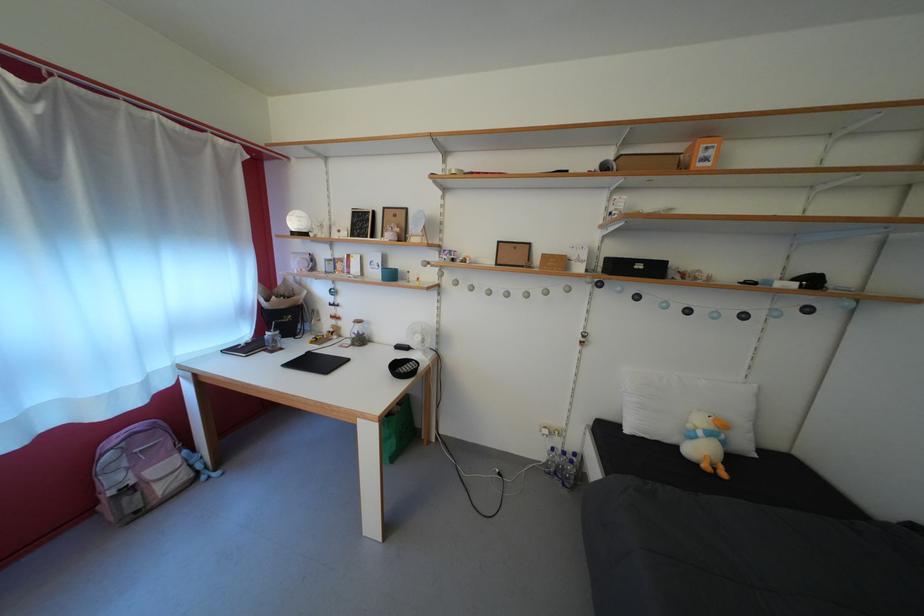
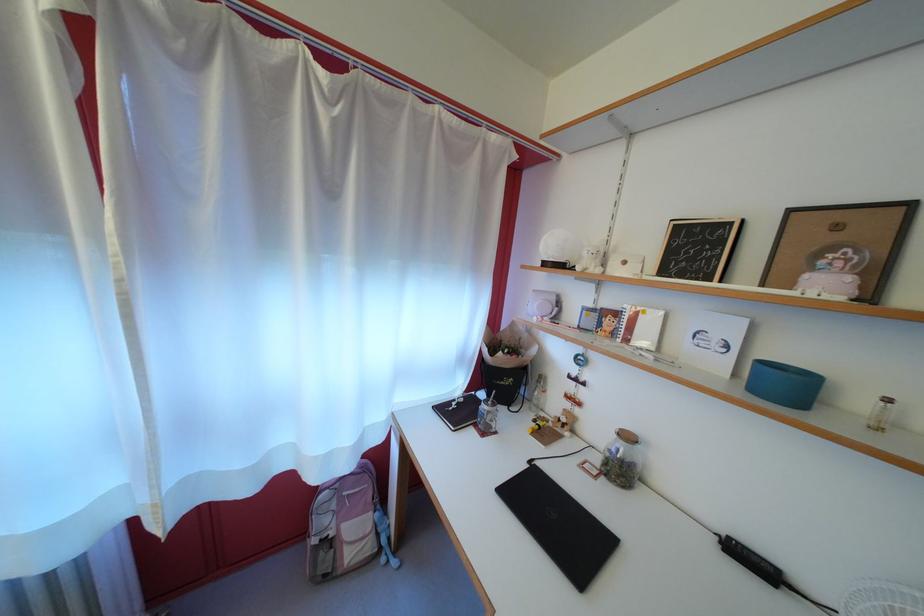
Find the pixel in the second image that matches (x=51, y=177) in the first image.

(335, 193)